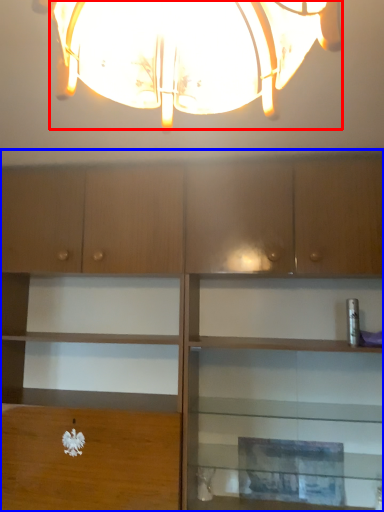
Question: Which object is closer to the camera taking this photo, lamp (highlighted by a red box) or cabinetry (highlighted by a blue box)?

Choices:
 (A) lamp
 (B) cabinetry

Answer: (A)